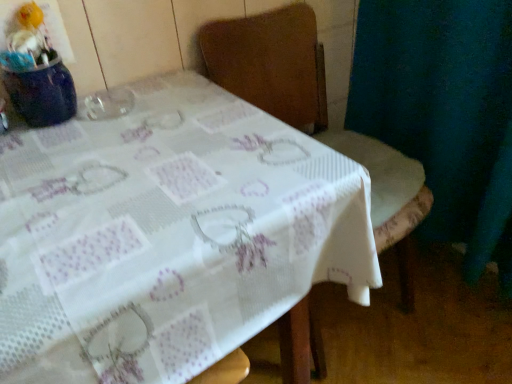
This screenshot has width=512, height=384. What do you see at coordinates (316, 114) in the screenshot?
I see `wooden chair at center` at bounding box center [316, 114].

In order to face wooden chair at center, should I rotate leftwards or rightwards?

It's best to rotate right around 8.650 degrees.

Locate an element on the screen. wooden chair at center is located at coordinates (316, 114).

This screenshot has height=384, width=512. What do you see at coordinates (167, 234) in the screenshot?
I see `white printed fabric at center` at bounding box center [167, 234].

Identify the location of white printed fabric at center. The height and width of the screenshot is (384, 512). (167, 234).

At what (x,y) coordinates should I click in order to perform the action: click on wooden chair at center. Please return your answer as a coordinate pair (x, y). Looking at the image, I should click on (316, 114).

In the scene shown: Which is more to the left, wooden chair at center or white printed fabric at center?

white printed fabric at center.

Is wooden chair at center behind white printed fabric at center?

That is True.

Considering the positions of point (287, 52) and point (128, 161), is point (287, 52) closer or farther from the camera than point (128, 161)?

Point (287, 52).

From the image's perspective, is wooden chair at center located beneath white printed fabric at center?

Actually, wooden chair at center appears above white printed fabric at center in the image.

From a real-world perspective, is wooden chair at center on top of white printed fabric at center?

Yes.

Is wooden chair at center thinner than white printed fabric at center?

Yes.

Is wooden chair at center taller or shorter than white printed fabric at center?

wooden chair at center is taller than white printed fabric at center.

Who is bigger, wooden chair at center or white printed fabric at center?

white printed fabric at center is bigger.

Looking at this image, do you think wooden chair at center is within white printed fabric at center, or outside of it?

wooden chair at center is not enclosed by white printed fabric at center.

Would you consider wooden chair at center to be distant from white printed fabric at center?

wooden chair at center is near white printed fabric at center, not far away.

Is wooden chair at center facing towards white printed fabric at center?

No.

How many degrees apart are the facing directions of wooden chair at center and white printed fabric at center?

wooden chair at center and white printed fabric at center are facing 0.288 degrees away from each other.

Locate an element on the screen. chair behind the white printed fabric at center is located at coordinates (316, 114).

Is white printed fabric at center at the left side of wooden chair at center?

Indeed, white printed fabric at center is positioned on the left side of wooden chair at center.

Is white printed fabric at center positioned behind wooden chair at center?

No, white printed fabric at center is in front of wooden chair at center.

Which is behind, point (210, 86) or point (315, 111)?

The point (315, 111) is more distant.

From the image's perspective, between white printed fabric at center and wooden chair at center, which one is located above?

wooden chair at center, from the image's perspective.

From a real-world perspective, relative to wooden chair at center, is white printed fabric at center vertically above or below?

white printed fabric at center is below wooden chair at center.

Does white printed fabric at center have a lesser width compared to wooden chair at center?

No.

Is white printed fabric at center shorter than wooden chair at center?

Indeed, white printed fabric at center has a lesser height compared to wooden chair at center.

Considering the sizes of white printed fabric at center and wooden chair at center in the image, is white printed fabric at center bigger or smaller than wooden chair at center?

white printed fabric at center is bigger than wooden chair at center.

Can wooden chair at center be found inside white printed fabric at center?

Actually, wooden chair at center is outside white printed fabric at center.

Are white printed fabric at center and wooden chair at center located far from each other?

No, white printed fabric at center is in close proximity to wooden chair at center.

Is white printed fabric at center oriented towards wooden chair at center?

No, white printed fabric at center is not oriented towards wooden chair at center.

How many degrees apart are the facing directions of white printed fabric at center and wooden chair at center?

0.288 degrees separate the facing orientations of white printed fabric at center and wooden chair at center.

Where is `table below the wooden chair at center (from a real-world perspective)`? This screenshot has height=384, width=512. table below the wooden chair at center (from a real-world perspective) is located at coordinates (167, 234).

At what (x,y) coordinates should I click in order to perform the action: click on chair located above the white printed fabric at center (from a real-world perspective). Please return your answer as a coordinate pair (x, y). The width and height of the screenshot is (512, 384). Looking at the image, I should click on (316, 114).

This screenshot has height=384, width=512. In the image, there is a wooden chair at center. Find the location of `table below it (from a real-world perspective)`. table below it (from a real-world perspective) is located at coordinates (167, 234).